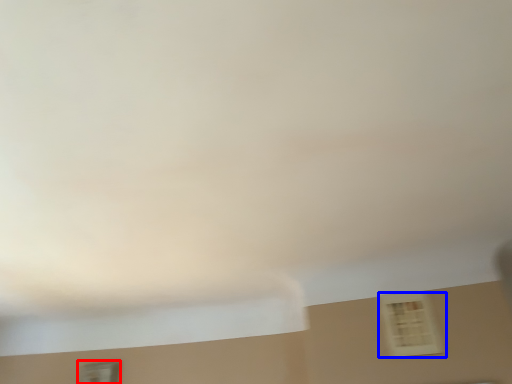
Question: Which of the following is the farthest to the observer, window (highlighted by a red box) or window (highlighted by a blue box)?

Choices:
 (A) window
 (B) window

Answer: (A)